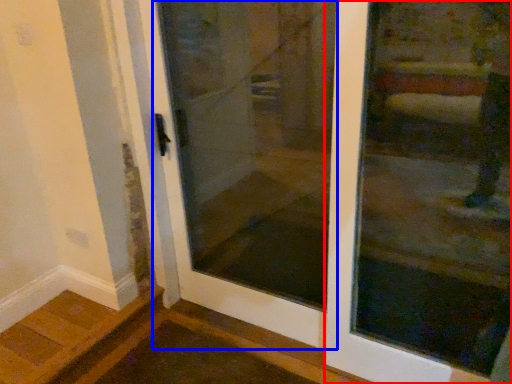
Question: Which of the following is the farthest to the observer, door (highlighted by a red box) or elevator door (highlighted by a blue box)?

Choices:
 (A) door
 (B) elevator door

Answer: (B)